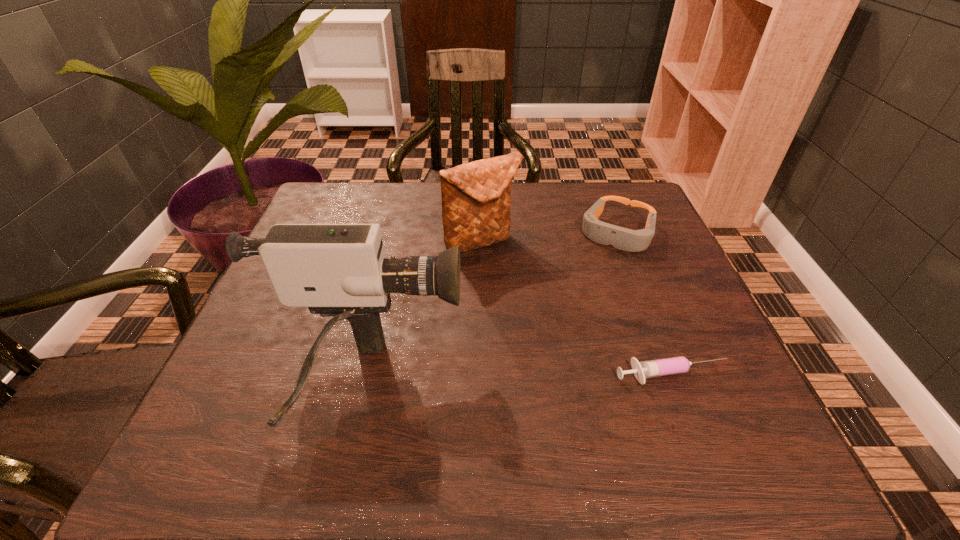
Find the location of `object that is at the far right corner`. object that is at the far right corner is located at coordinates (604, 233).

Locate an element on the screen. object that is positioned at the near right corner is located at coordinates (675, 365).

In the image, there is a desktop. At what (x,y) coordinates should I click in order to perform the action: click on free space at the far edge. Please return your answer as a coordinate pair (x, y). The image size is (960, 540). Looking at the image, I should click on (443, 231).

This screenshot has width=960, height=540. In the image, there is a desktop. In order to click on vacant space at the near edge in this screenshot , I will do `click(564, 399)`.

Where is `blank space at the right edge`? This screenshot has width=960, height=540. blank space at the right edge is located at coordinates [677, 340].

Locate an element on the screen. The image size is (960, 540). free space at the far left corner is located at coordinates (358, 206).

The height and width of the screenshot is (540, 960). I want to click on vacant space at the far right corner of the desktop, so click(x=636, y=201).

Identify the location of free space at the near right corner of the desktop. (712, 402).

Find the location of a particular element. This screenshot has width=960, height=540. empty space that is in between the shortest object and the goggles is located at coordinates (645, 305).

Find the location of a particular element. This screenshot has height=540, width=960. vacant space that is in between the second tallest object and the tallest object is located at coordinates (423, 312).